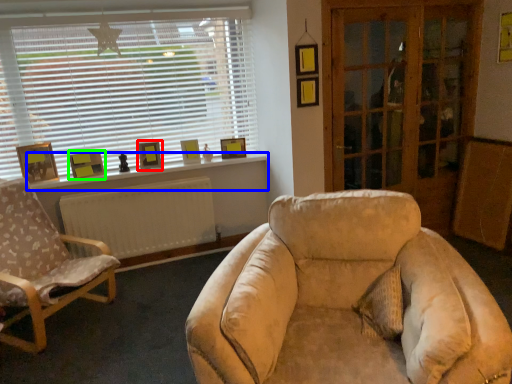
Question: Considering the real-world distances, which object is closest to picture frame (highlighted by a red box)? window sill (highlighted by a blue box) or picture frame (highlighted by a green box).

Choices:
 (A) window sill
 (B) picture frame

Answer: (A)